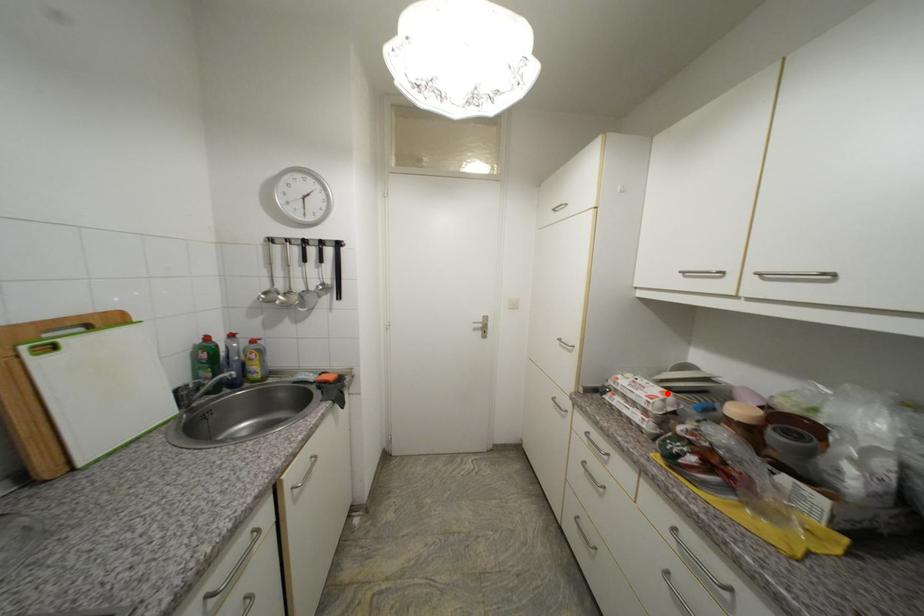
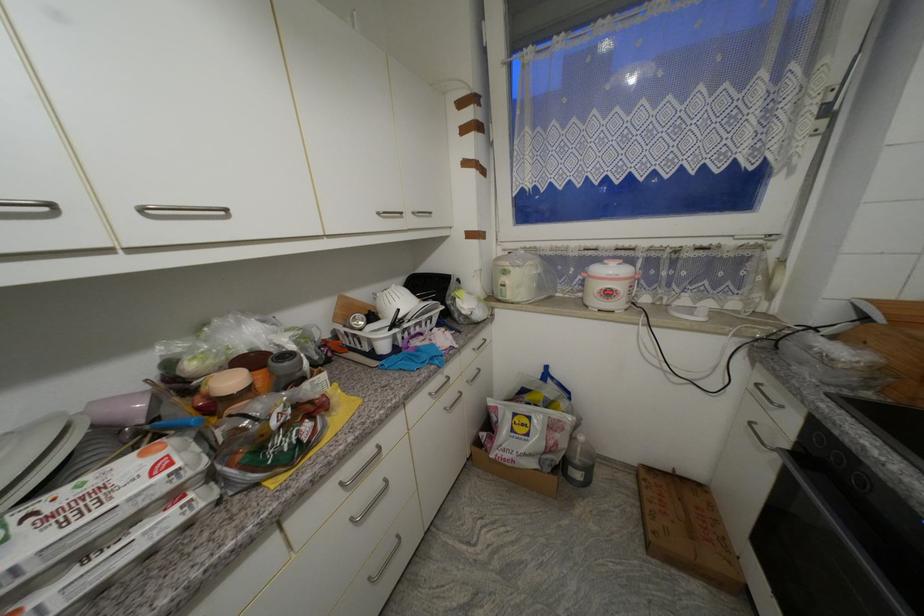
Where in the second image is the point corresponding to the highlighted location from the first image?

(149, 456)